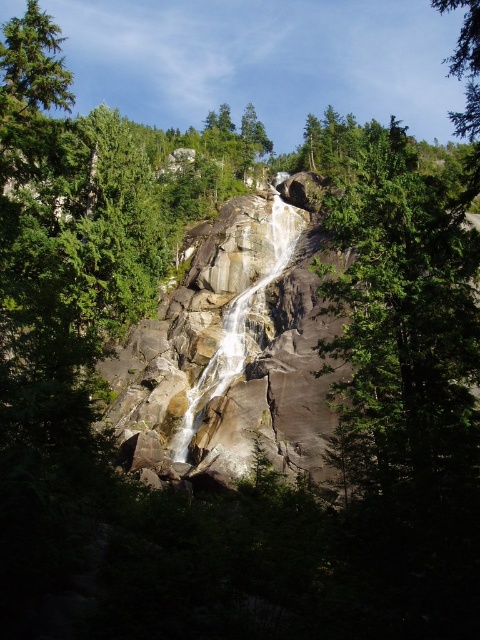
You are standing at the base of the waterfall and want to take a photo. There are two points marked in the scene, point (x=420, y=417) and point (x=207, y=378). Which point should you focus on to ensure it appears larger in your photo?

Point (x=420, y=417) should be focused on because it is closer to the camera and will appear larger in the photo compared to point (x=207, y=378) which is farther away.

You are standing in front of the waterfall and want to take a photo of both the green rough bark tree at center and the smooth gray rock waterfall at center. Which object should you adjust your camera to focus on first if you want to include both in the frame?

The green rough bark tree at center is to the right of the smooth gray rock waterfall at center. Therefore, you should adjust your camera to focus on the smooth gray rock waterfall at center first, as it is positioned to the left of the tree, ensuring both are captured in the frame.

You are standing at the bottom of the waterfall and want to find the green rough bark tree at center. Based on the 2D coordinates provided, in which direction should you look to locate it?

The green rough bark tree at center is located at coordinates 0.506 on the x axis and 0.842 on the y axis. Since you are at the bottom of the waterfall, looking upwards would align with increasing y values. Therefore, you should look upward to find the green rough bark tree at center.